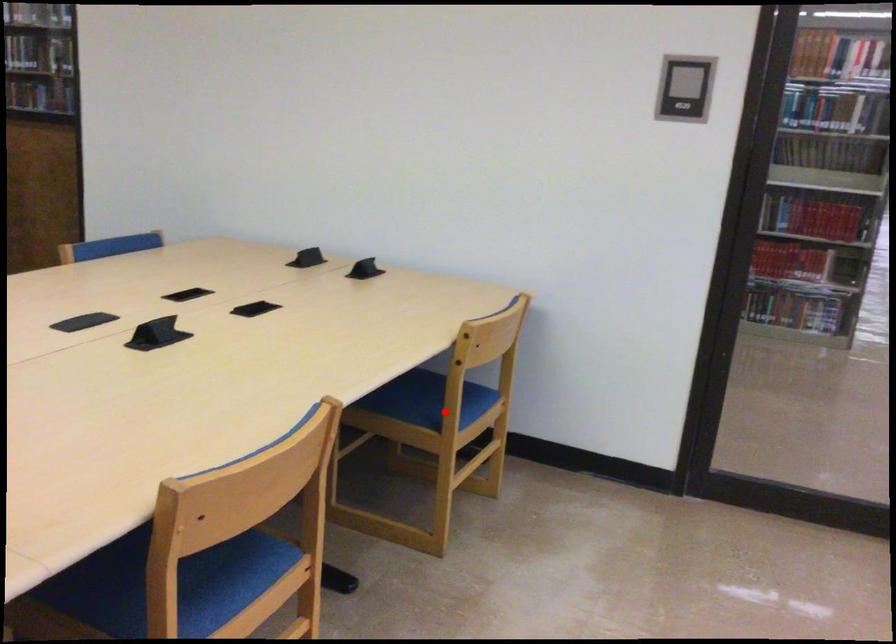
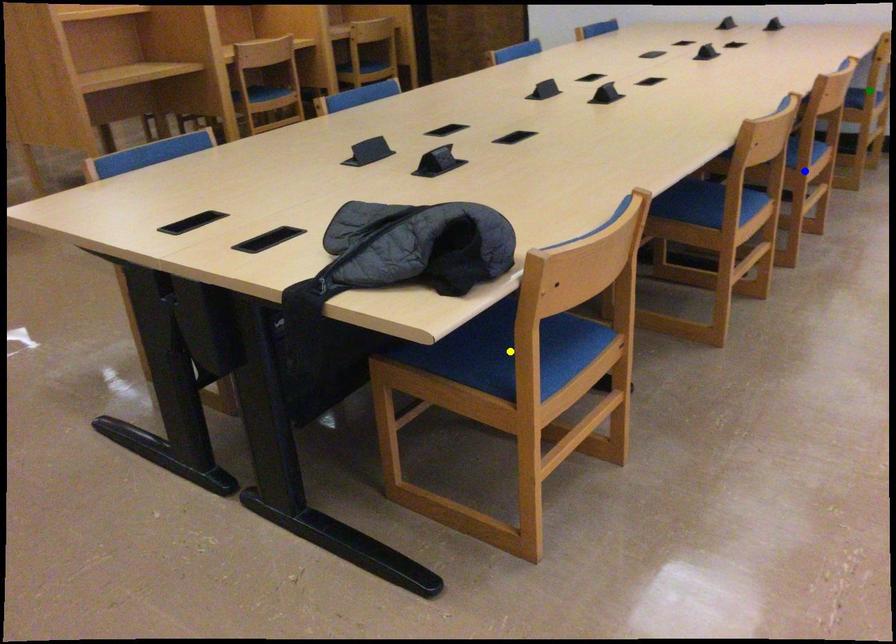
Question: I am providing you with two images of the same scene from different viewpoints. A red point is marked on the first image. You are given multiple points on the second image. Which spot in image 2 lines up with the point in image 1?

Choices:
 (A) blue point
 (B) green point
 (C) yellow point

Answer: (B)